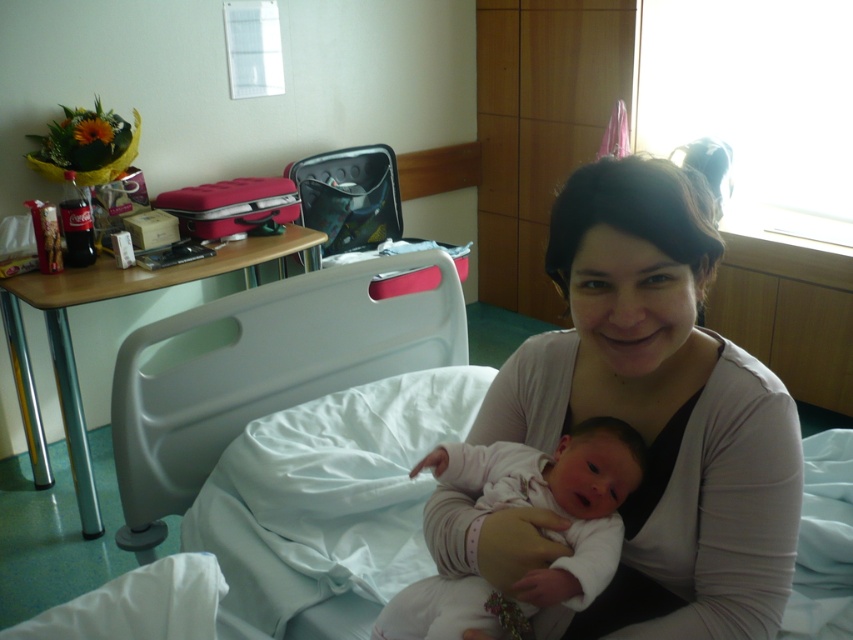
Question: Is smooth white shirt at center to the left of white fabric hospital bed at center from the viewer's perspective?

Choices:
 (A) yes
 (B) no

Answer: (B)

Question: Does smooth white shirt at center have a lesser width compared to light pink fabric newborn at center?

Choices:
 (A) yes
 (B) no

Answer: (B)

Question: Considering the real-world distances, which object is farthest from the light pink fabric newborn at center?

Choices:
 (A) white fabric hospital bed at center
 (B) smooth white shirt at center

Answer: (A)

Question: Estimate the real-world distances between objects in this image. Which object is closer to the smooth white shirt at center?

Choices:
 (A) light pink fabric newborn at center
 (B) white fabric hospital bed at center

Answer: (A)

Question: Among these objects, which one is farthest from the camera?

Choices:
 (A) smooth white shirt at center
 (B) white fabric hospital bed at center

Answer: (B)

Question: Does smooth white shirt at center appear under light pink fabric newborn at center?

Choices:
 (A) no
 (B) yes

Answer: (A)